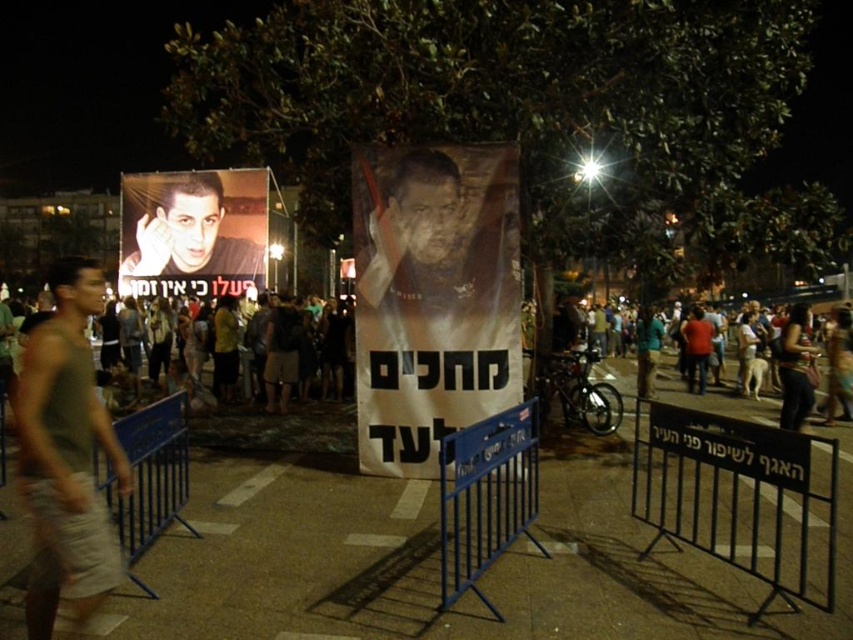
Question: Is matte plastic poster at upper left wider than dark clothing crowd at center?

Choices:
 (A) yes
 (B) no

Answer: (B)

Question: Which point appears closest to the camera in this image?

Choices:
 (A) (22, 420)
 (B) (120, 291)
 (C) (788, 316)
 (D) (450, 499)

Answer: (A)

Question: Does dark clothing crowd at center appear on the left side of dark brown leather jacket at lower right?

Choices:
 (A) no
 (B) yes

Answer: (A)

Question: Is blue metal barricade at lower left thinner than dark clothing crowd at center?

Choices:
 (A) no
 (B) yes

Answer: (B)

Question: Which is nearer to the blue metal barricade at lower left?

Choices:
 (A) green fabric tank top at left
 (B) metallic poster at center
 (C) dark brown leather jacket at lower right

Answer: (A)

Question: Among these points, which one is farthest from the camera?

Choices:
 (A) (427, 198)
 (B) (250, 280)

Answer: (B)